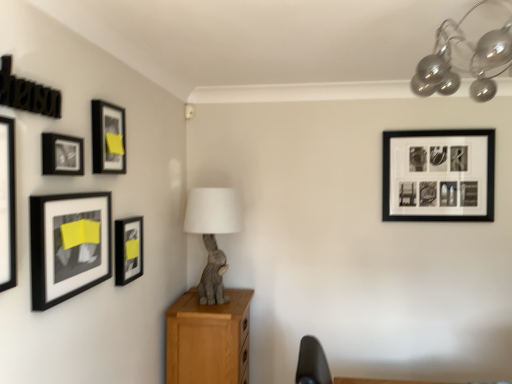
Question: In terms of height, does matte black picture frame at upper left, the 2th picture frame when ordered from left to right, look taller or shorter compared to black matte picture frame at upper right, positioned as the sixth picture frame in front-to-back order?

Choices:
 (A) tall
 (B) short

Answer: (B)

Question: Considering their positions, is matte black picture frame at upper left, which appears as the 5th picture frame when viewed from the right, located in front of or behind black matte picture frame at upper right, positioned as the 1th picture frame in right-to-left order?

Choices:
 (A) behind
 (B) front

Answer: (B)

Question: Estimate the real-world distances between objects in this image. Which object is closer to the matte black picture frame at left, arranged as the fifth picture frame when viewed from the back?

Choices:
 (A) matte black picture frame at upper left, which ranks as the third picture frame in right-to-left order
 (B) wooden cabinet at center
 (C) matte black picture frame at upper left, which is the 4th picture frame in back-to-front order
 (D) black matte picture frame at upper right, marked as the first picture frame in a back-to-front arrangement
 (E) metallic glass chandelier at upper right

Answer: (C)

Question: Which object is positioned closest to the black matte picture frame at upper right, positioned as the sixth picture frame in front-to-back order?

Choices:
 (A) matte black picture frame at left, marked as the 6th picture frame in a back-to-front arrangement
 (B) matte black picture frame at left, the fourth picture frame in the right-to-left sequence
 (C) matte black picture frame at left, acting as the 2th picture frame starting from the right
 (D) metallic glass chandelier at upper right
 (E) gray fabric rabbit at center

Answer: (D)